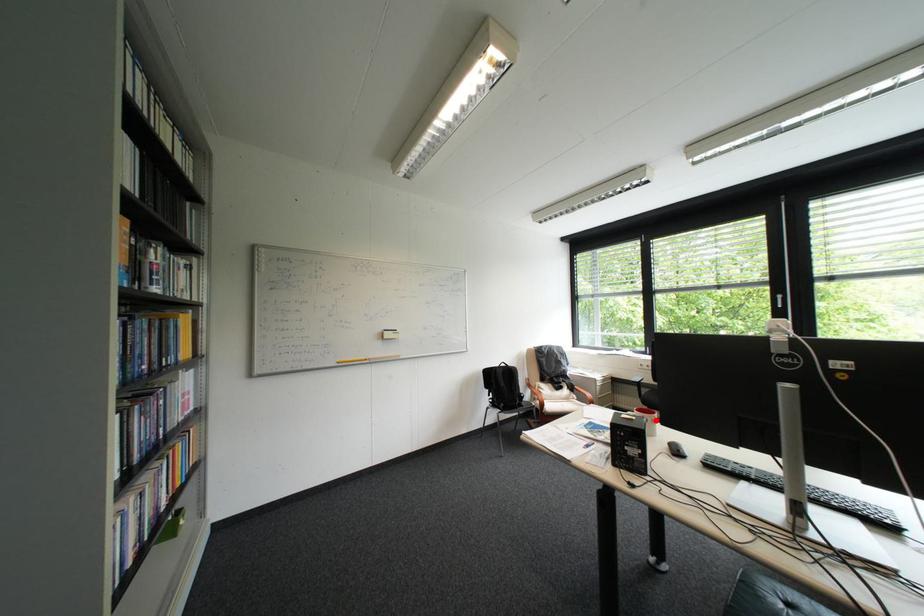
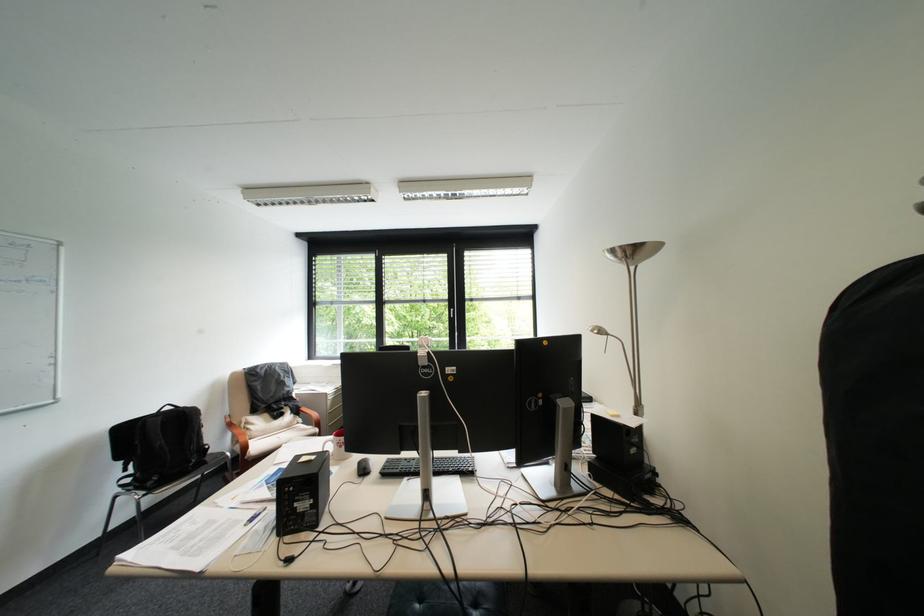
Question: I am providing you with two images of the same scene from different viewpoints. Image1 has a red point marked. In image2, the corresponding 3D location appears at what relative position? Reply with the corresponding letter.

Choices:
 (A) Closer
 (B) Farther

Answer: (B)